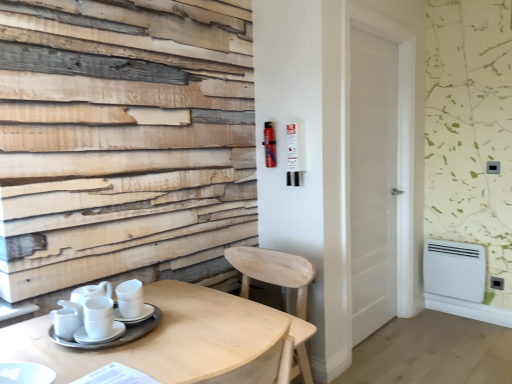
Question: Can you confirm if white glossy cups at lower left is smaller than white glossy cup at center?

Choices:
 (A) yes
 (B) no

Answer: (A)

Question: Is white glossy cups at lower left turned away from white glossy cup at center?

Choices:
 (A) yes
 (B) no

Answer: (B)

Question: Does white glossy cups at lower left come in front of white glossy cup at center?

Choices:
 (A) no
 (B) yes

Answer: (B)

Question: Does white glossy cups at lower left touch white glossy cup at center?

Choices:
 (A) no
 (B) yes

Answer: (A)

Question: Is white glossy cups at lower left further to the viewer compared to white glossy cup at center?

Choices:
 (A) yes
 (B) no

Answer: (B)

Question: Looking at the image, does white plastic radiator at lower right seem bigger or smaller compared to light wood chair at lower center?

Choices:
 (A) big
 (B) small

Answer: (B)

Question: From their relative heights in the image, would you say white plastic radiator at lower right is taller or shorter than light wood chair at lower center?

Choices:
 (A) tall
 (B) short

Answer: (B)

Question: From the image's perspective, is white plastic radiator at lower right located above or below light wood chair at lower center?

Choices:
 (A) below
 (B) above

Answer: (B)

Question: Is white plastic radiator at lower right situated inside light wood chair at lower center or outside?

Choices:
 (A) outside
 (B) inside

Answer: (A)

Question: Is metallic red extinguisher at upper right inside or outside of white ceramic saucer at table?

Choices:
 (A) outside
 (B) inside

Answer: (A)

Question: Is point (266, 148) positioned closer to the camera than point (153, 311)?

Choices:
 (A) farther
 (B) closer

Answer: (A)

Question: Visually, is metallic red extinguisher at upper right positioned to the left or to the right of white ceramic saucer at table?

Choices:
 (A) left
 (B) right

Answer: (B)

Question: From the image's perspective, relative to white ceramic saucer at table, is metallic red extinguisher at upper right above or below?

Choices:
 (A) above
 (B) below

Answer: (A)

Question: From a real-world perspective, is light wood table at lower left positioned above or below light wood chair at lower center?

Choices:
 (A) above
 (B) below

Answer: (B)

Question: Is light wood table at lower left taller or shorter than light wood chair at lower center?

Choices:
 (A) short
 (B) tall

Answer: (A)